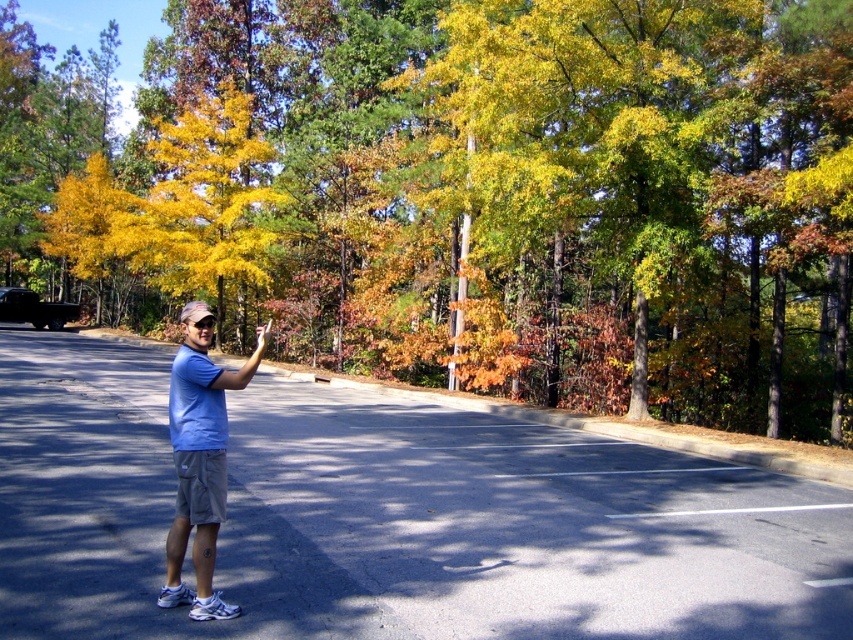
Is yellow leafy tree at center wider than blue cotton shirt at center?

Correct, the width of yellow leafy tree at center exceeds that of blue cotton shirt at center.

Between point (242, 205) and point (201, 339), which one is positioned behind?

Positioned behind is point (242, 205).

Between point (112, 275) and point (222, 417), which one is positioned in front?

Point (222, 417)

Locate an element on the screen. Image resolution: width=853 pixels, height=640 pixels. yellow leafy tree at center is located at coordinates (469, 195).